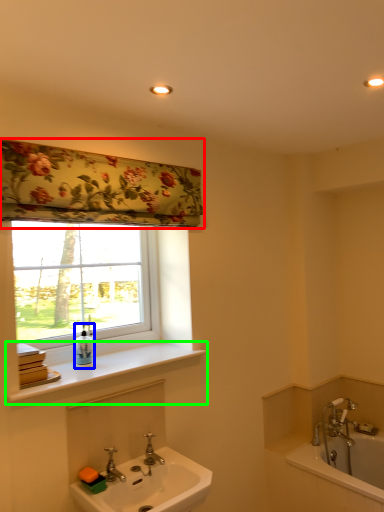
Question: Which object is the farthest from shower curtain (highlighted by a red box)? Choose among these: soap dispenser (highlighted by a blue box) or window sill (highlighted by a green box).

Choices:
 (A) soap dispenser
 (B) window sill

Answer: (A)